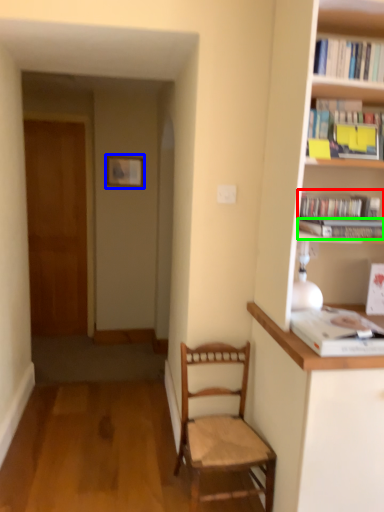
Question: Considering the real-world distances, which object is farthest from book (highlighted by a red box)? picture frame (highlighted by a blue box) or book (highlighted by a green box)?

Choices:
 (A) picture frame
 (B) book

Answer: (A)